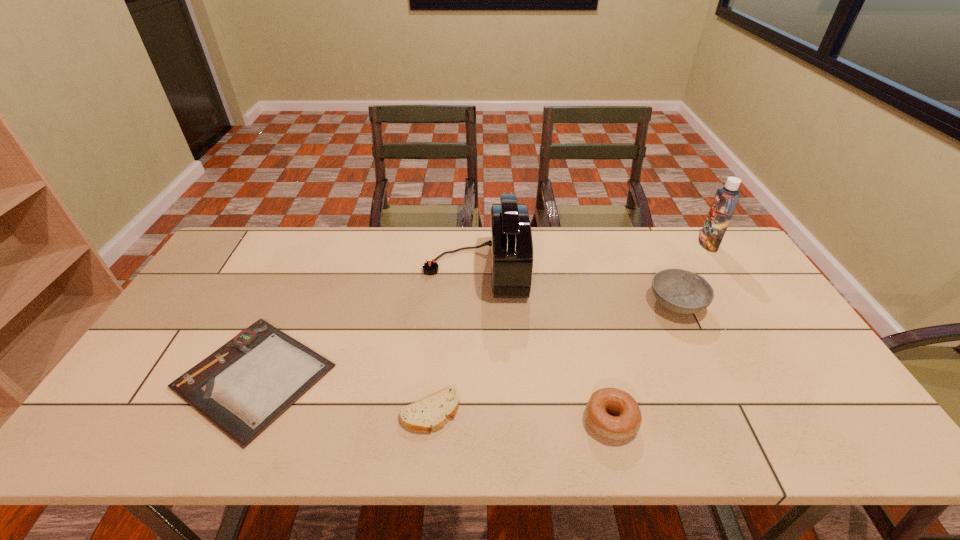
Find the location of a particular element. The height and width of the screenshot is (540, 960). empty space between the fifth object from left to right and the radio receiver is located at coordinates (576, 286).

Where is `object that is the fifth closest to the third object from right to left`? This screenshot has width=960, height=540. object that is the fifth closest to the third object from right to left is located at coordinates pyautogui.click(x=726, y=199).

I want to click on the fifth closest object to the bagel, so click(726, 199).

I want to click on vacant space that satisfies the following two spatial constraints: 1. on the front label of the shampoo; 2. on the front side of the fifth object from left to right, so click(x=747, y=303).

The image size is (960, 540). Identify the location of vacant region that satisfies the following two spatial constraints: 1. on the front-facing side of the radio receiver; 2. on the front side of the shortest object. (475, 376).

Identify the location of vacant space that satisfies the following two spatial constraints: 1. on the back side of the second object from right to left; 2. on the front-facing side of the radio receiver. Image resolution: width=960 pixels, height=540 pixels. (660, 269).

Image resolution: width=960 pixels, height=540 pixels. Find the location of `vacant area that satisfies the following two spatial constraints: 1. on the back side of the fifth object from left to right; 2. on the front-facing side of the radio receiver`. vacant area that satisfies the following two spatial constraints: 1. on the back side of the fifth object from left to right; 2. on the front-facing side of the radio receiver is located at coordinates (660, 269).

You are a GUI agent. You are given a task and a screenshot of the screen. Output one action in this format:
    pyautogui.click(x=<x>, y=<y>)
    Task: Click on the free location that satisfies the following two spatial constraints: 1. on the front label of the rightmost object; 2. on the front side of the fifth tallest object
    The width and height of the screenshot is (960, 540).
    Given the screenshot: What is the action you would take?
    pyautogui.click(x=817, y=412)

You are a GUI agent. You are given a task and a screenshot of the screen. Output one action in this format:
    pyautogui.click(x=<x>, y=<y>)
    Task: Click on the free space in the image that satisfies the following two spatial constraints: 1. on the front-facing side of the radio receiver; 2. on the right side of the third shortest object
    
    Given the screenshot: What is the action you would take?
    pyautogui.click(x=474, y=421)

Locate an element on the screen. vacant space that satisfies the following two spatial constraints: 1. on the back side of the fourth shortest object; 2. on the front-facing side of the radio receiver is located at coordinates (660, 269).